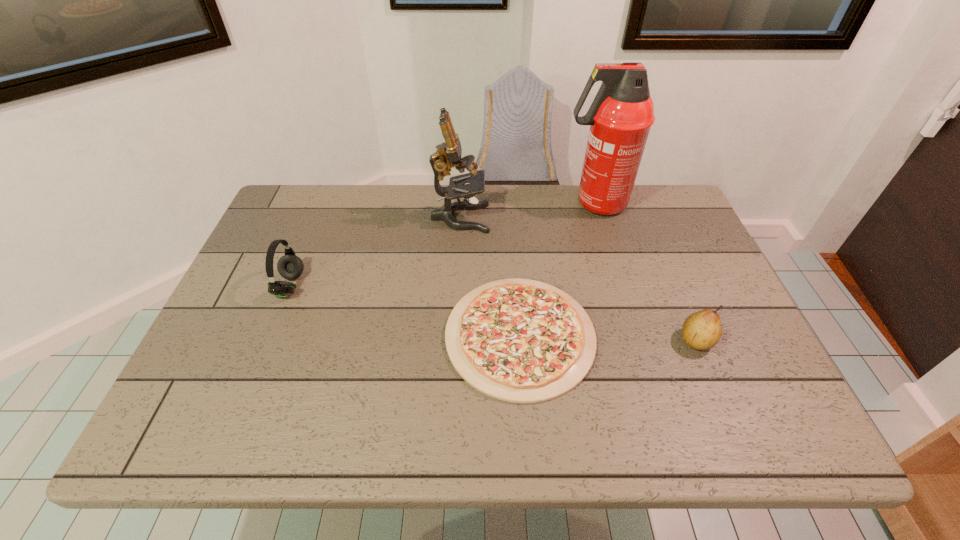
Identify the location of free space located on the ear cups of the headset. (455, 286).

Image resolution: width=960 pixels, height=540 pixels. I want to click on vacant space positioned on the front of the pear, so click(x=713, y=383).

Where is `vacant space located 0.250m on the back of the pizza`? The width and height of the screenshot is (960, 540). vacant space located 0.250m on the back of the pizza is located at coordinates (511, 221).

Where is `fire extinguisher that is at the far edge`? The height and width of the screenshot is (540, 960). fire extinguisher that is at the far edge is located at coordinates (620, 117).

This screenshot has height=540, width=960. What are the coordinates of `microscope located in the far edge section of the desktop` in the screenshot? It's located at (448, 155).

Identify the location of object located at the near edge. The width and height of the screenshot is (960, 540). (523, 341).

You are a GUI agent. You are given a task and a screenshot of the screen. Output one action in this format:
    pyautogui.click(x=<x>, y=<y>)
    Task: Click on the object located in the left edge section of the desktop
    
    Given the screenshot: What is the action you would take?
    pyautogui.click(x=289, y=266)

The width and height of the screenshot is (960, 540). Identify the location of fire extinguisher present at the right edge. (620, 117).

Where is `pear located at the right edge`? pear located at the right edge is located at coordinates (702, 330).

Identify the location of object that is at the far right corner. The image size is (960, 540). (620, 117).